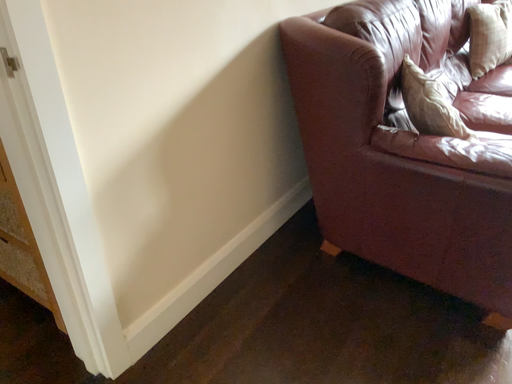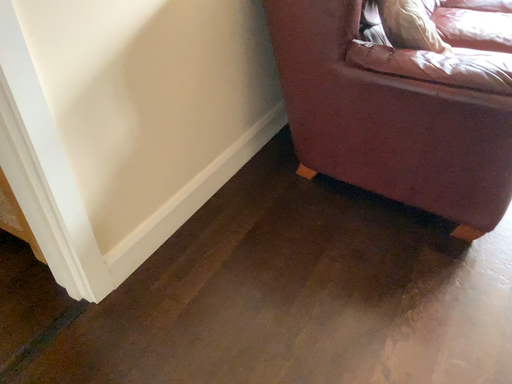
Question: Which way did the camera rotate in the video?

Choices:
 (A) rotated upward
 (B) rotated downward

Answer: (B)